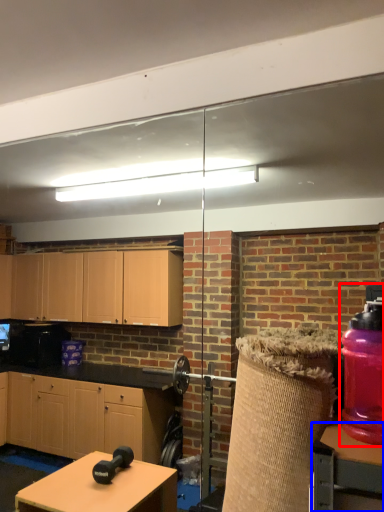
Question: Which object is further to the camera taking this photo, bottle (highlighted by a red box) or table (highlighted by a blue box)?

Choices:
 (A) bottle
 (B) table

Answer: (A)